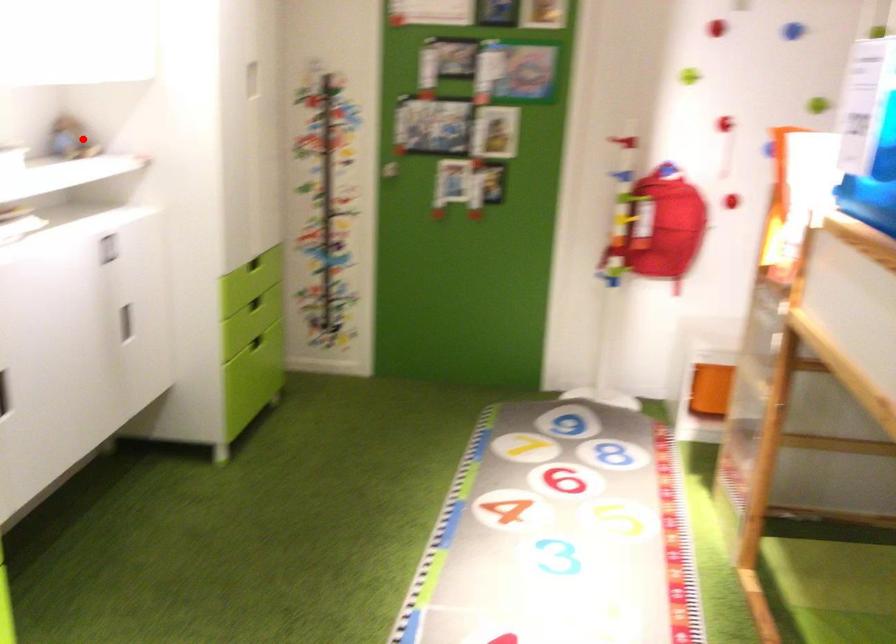
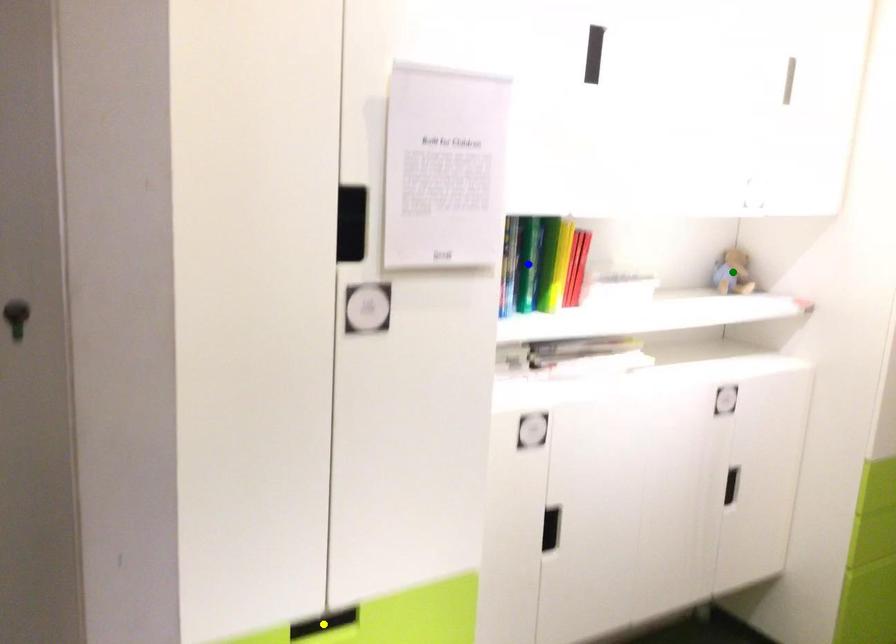
Question: I am providing you with two images of the same scene from different viewpoints. A red point is marked on the first image. You are given multiple points on the second image. Which mark in image 2 goes with the point in image 1?

Choices:
 (A) green point
 (B) blue point
 (C) yellow point

Answer: (A)